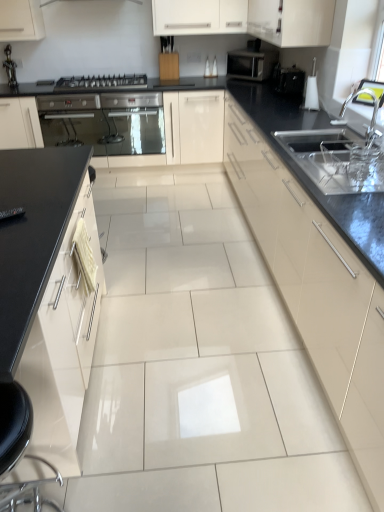
Question: Looking at the image, does black glossy toaster at upper right seem bigger or smaller compared to white glossy cabinet at upper center, which is the third cabinetry in right-to-left order?

Choices:
 (A) small
 (B) big

Answer: (A)

Question: Is black glossy toaster at upper right inside the boundaries of white glossy cabinet at upper center, which is the third cabinetry in right-to-left order, or outside?

Choices:
 (A) inside
 (B) outside

Answer: (B)

Question: Which of these objects is positioned farthest from the matte black microwave at upper right?

Choices:
 (A) metallic stainless steel oven at left
 (B) white glossy cabinet at left, which ranks as the first cabinetry in left-to-right order
 (C) matte cream cabinet at center, positioned as the third cabinetry in left-to-right order
 (D) metallic silver gas stove at center-left
 (E) black glossy toaster at upper right

Answer: (B)

Question: Which of these objects is positioned farthest from the metallic silver gas stove at center-left?

Choices:
 (A) white glossy cabinet at left, which ranks as the first cabinetry in left-to-right order
 (B) black glossy toaster at upper right
 (C) metallic stainless steel oven at left
 (D) black leather swivel chair at lower left
 (E) white glossy cabinet at upper center, the fourth cabinetry from the left

Answer: (D)